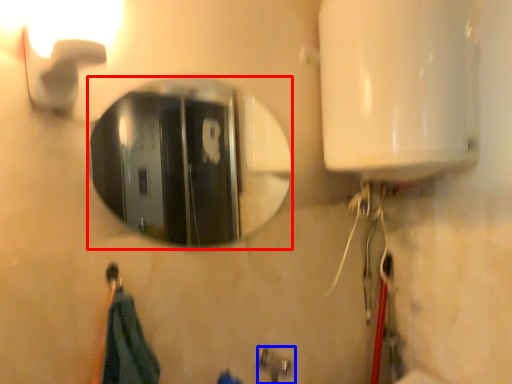
Question: Which point is further to the camera, mirror (highlighted by a red box) or plumbing fixture (highlighted by a blue box)?

Choices:
 (A) mirror
 (B) plumbing fixture

Answer: (B)